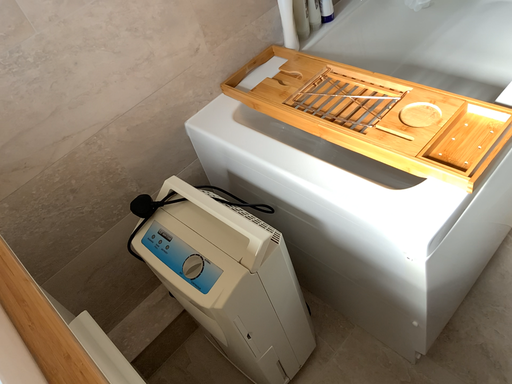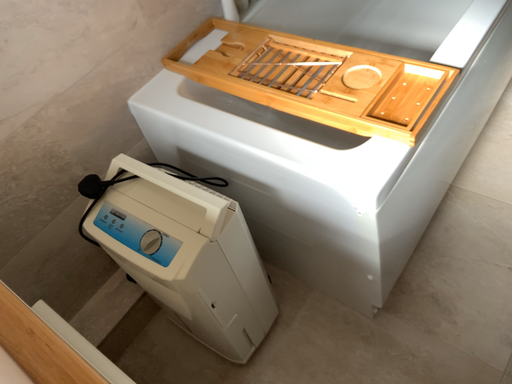
Question: How did the camera likely rotate when shooting the video?

Choices:
 (A) rotated left
 (B) rotated right

Answer: (B)